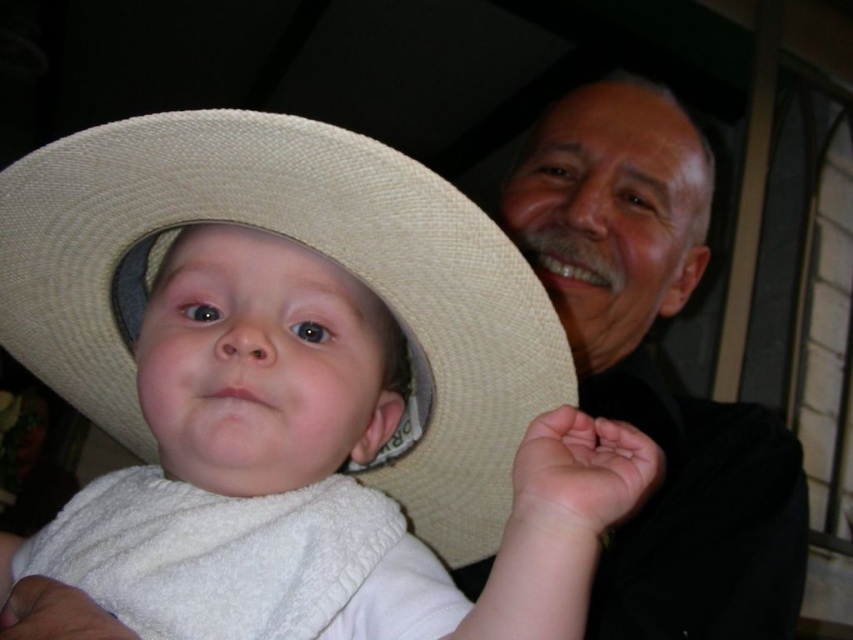
Question: Which object appears closest to the camera in this image?

Choices:
 (A) smooth black shirt at upper right
 (B) beige straw cowboy hat at center

Answer: (B)

Question: Considering the relative positions of beige straw cowboy hat at center and smooth black shirt at upper right in the image provided, where is beige straw cowboy hat at center located with respect to smooth black shirt at upper right?

Choices:
 (A) below
 (B) above

Answer: (A)

Question: Does beige straw cowboy hat at center have a smaller size compared to smooth black shirt at upper right?

Choices:
 (A) yes
 (B) no

Answer: (A)

Question: Among these points, which one is farthest from the camera?

Choices:
 (A) (445, 234)
 (B) (531, 244)

Answer: (B)

Question: From the image, what is the correct spatial relationship of beige straw cowboy hat at center in relation to smooth black shirt at upper right?

Choices:
 (A) above
 (B) below

Answer: (B)